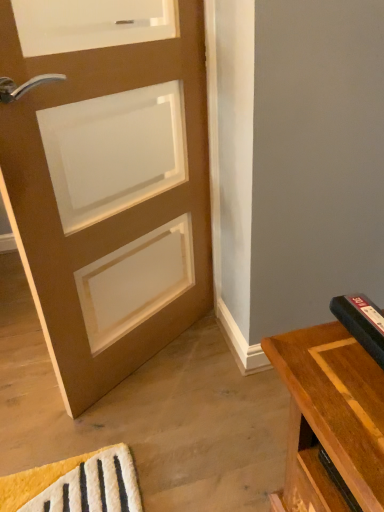
Describe the element at coordinates (108, 180) in the screenshot. I see `matte brown door at left` at that location.

In order to click on matte brown door at left in this screenshot , I will do `click(108, 180)`.

What is the approximate height of matte brown door at left?

matte brown door at left is 3.93 feet tall.

At what (x,y) coordinates should I click in order to perform the action: click on matte brown door at left. Please return your answer as a coordinate pair (x, y). Looking at the image, I should click on (108, 180).